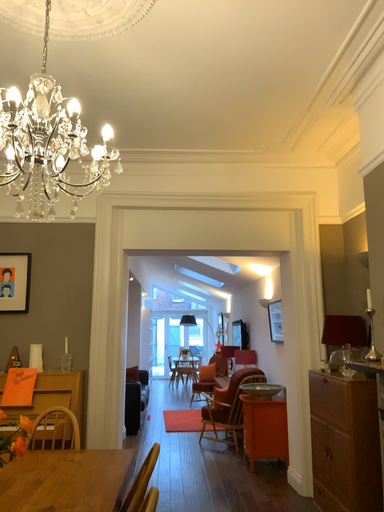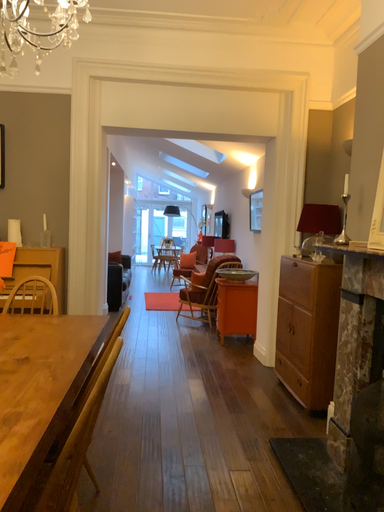
Question: How did the camera likely rotate when shooting the video?

Choices:
 (A) rotated downward
 (B) rotated upward

Answer: (A)